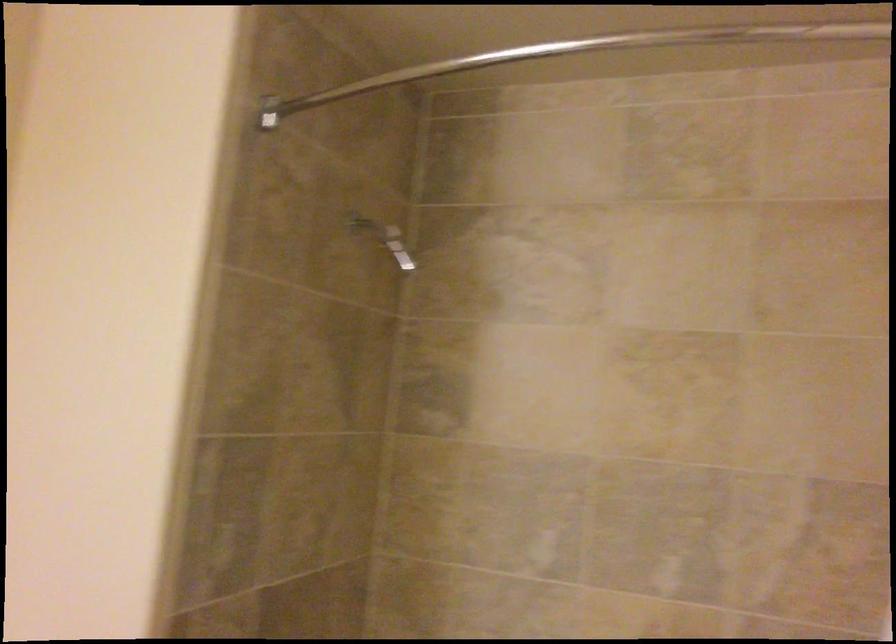
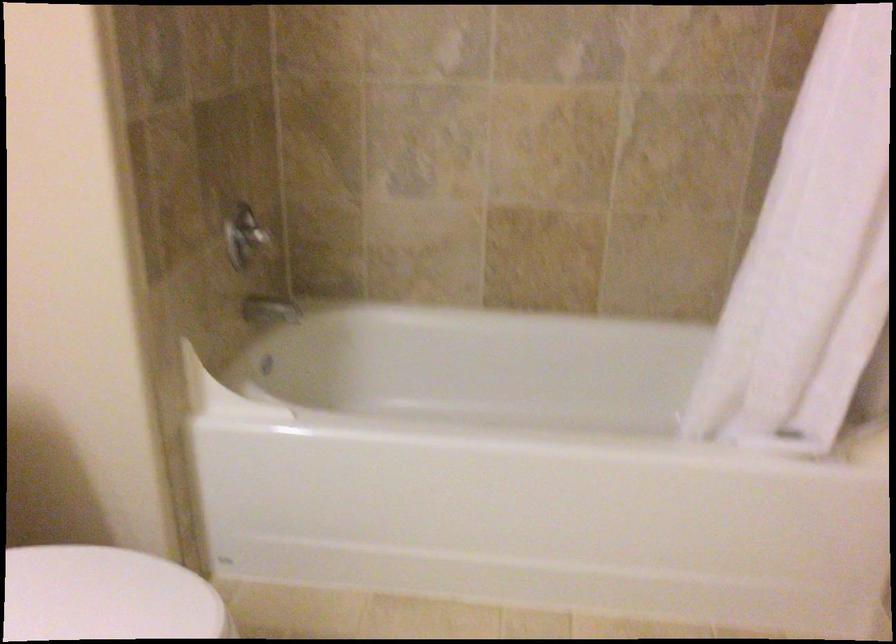
The first image is from the beginning of the video and the second image is from the end. How did the camera likely rotate when shooting the video?

The camera rotated toward right-down.